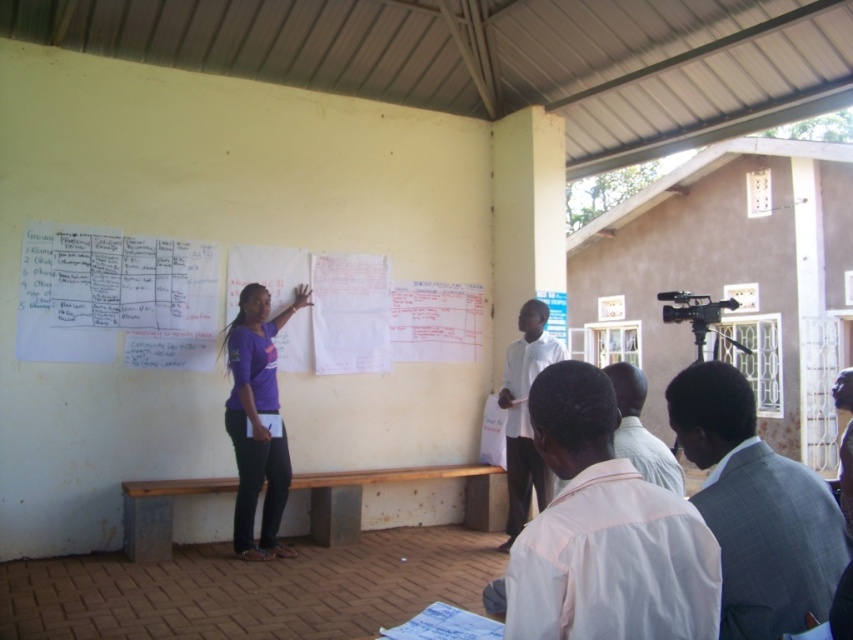
Where is the gray checkered suit at lower right located in the image?

The gray checkered suit at lower right is located at point [756,508].

You are a photographer standing at the back of the room. You want to take a photo of the gray checkered suit at lower right and the white matte shirt at center so that both are clearly visible in the frame. Given that your camera has a maximum focus range of 3 meters, will you be able to capture both subjects in focus?

The distance between the gray checkered suit at lower right and the white matte shirt at center is 3.64 meters, which exceeds the camera maximum focus range of 3 meters. Therefore, it will be difficult to capture both subjects in focus.

You are standing at the origin point of the coordinate system in the room. Where is the gray checkered suit at lower right located in terms of its 2D coordinates?

The gray checkered suit at lower right is located at the 2D coordinates of point (756, 508).